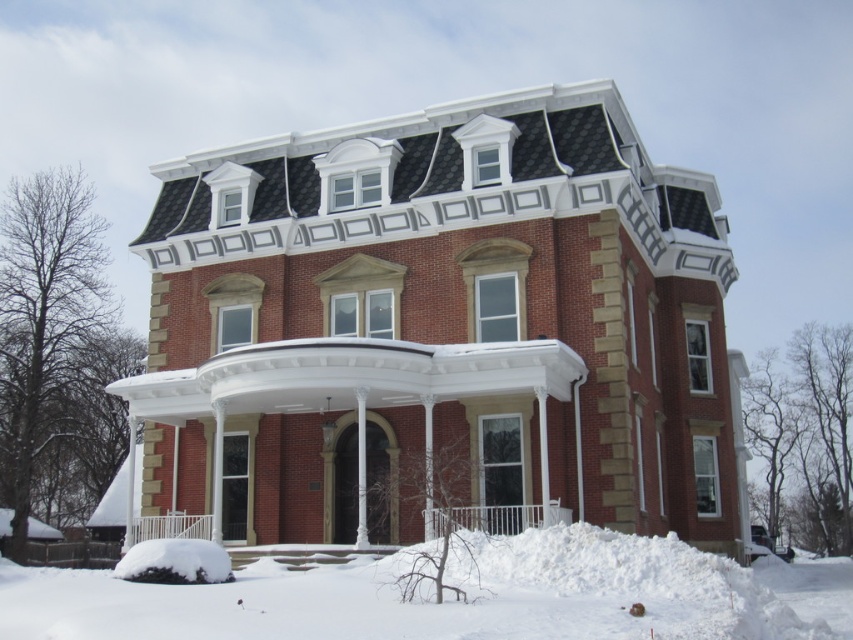
You are planning to build a small garden shed on the property. The shed requires a flat area that is wider than the white painted wood porch at center. Can the white fluffy snow at lower center provide a suitable location for this shed?

The white fluffy snow at lower center might be wider than the white painted wood porch at center, so it could potentially provide a suitable location for the shed if the snow coverage indicates sufficient width.